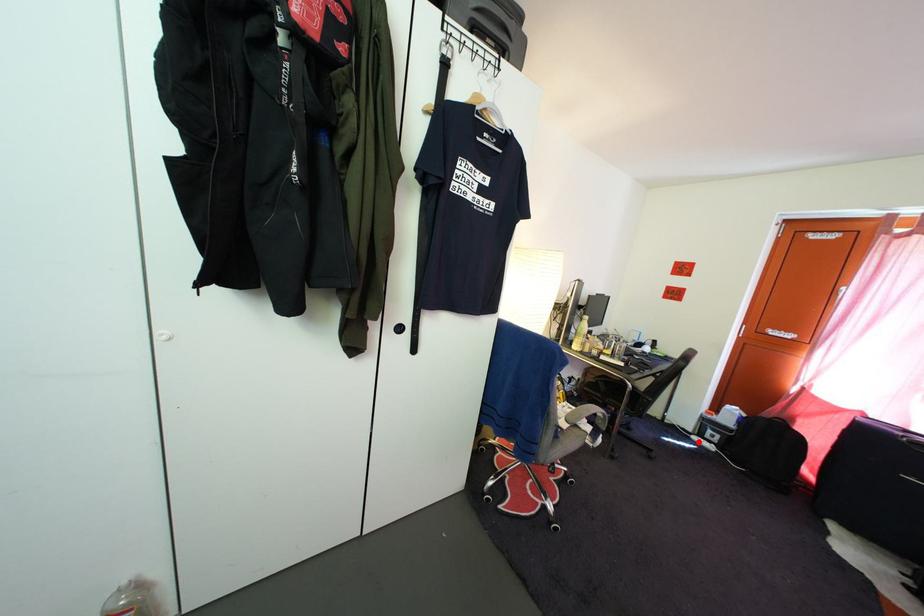
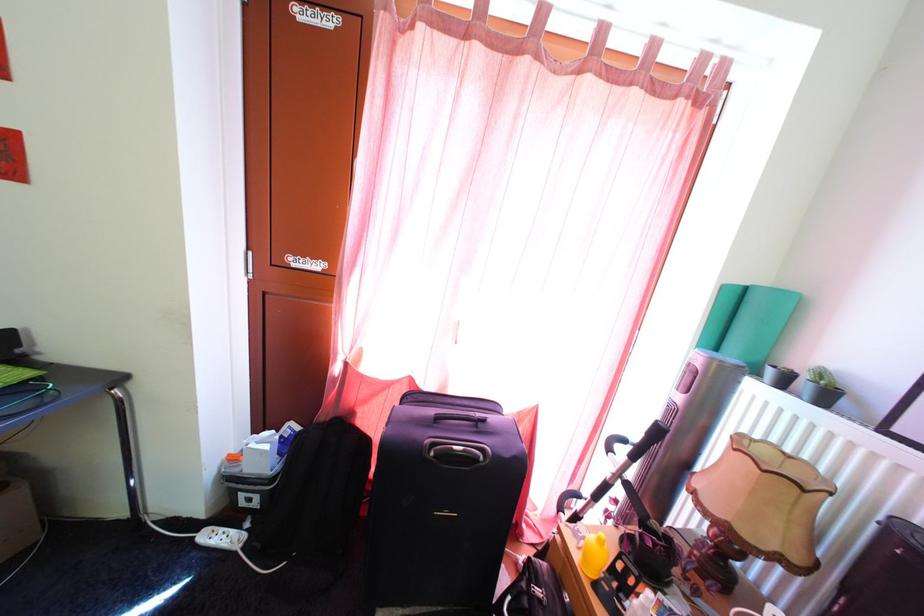
The point at the highlighted location is marked in the first image. Where is the corresponding point in the second image?

(208, 533)